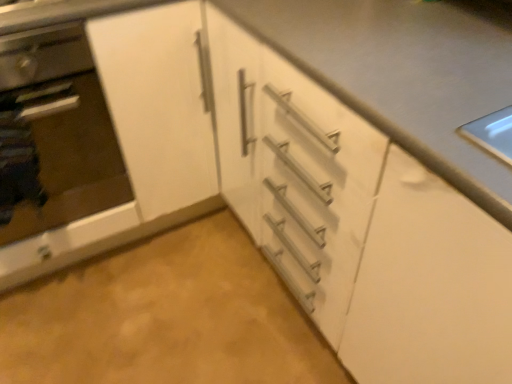
The height and width of the screenshot is (384, 512). I want to click on white matte cabinet at center, so click(x=109, y=133).

You are a GUI agent. You are given a task and a screenshot of the screen. Output one action in this format:
    pyautogui.click(x=<x>, y=<y>)
    Task: Click on the satin silver oven at left
    The width and height of the screenshot is (512, 384).
    Given the screenshot: What is the action you would take?
    pyautogui.click(x=54, y=134)

Where is `white matte countertop at center`? Image resolution: width=512 pixels, height=384 pixels. white matte countertop at center is located at coordinates (406, 73).

Can you tell me how much white matte countertop at center and satin silver oven at left differ in facing direction?

The angle between the facing direction of white matte countertop at center and the facing direction of satin silver oven at left is 89.5 degrees.

Can you confirm if white matte countertop at center is positioned to the left of satin silver oven at left?

Incorrect, white matte countertop at center is not on the left side of satin silver oven at left.

Which of these two, white matte countertop at center or satin silver oven at left, is bigger?

Bigger between the two is white matte countertop at center.

Do you think white matte countertop at center is within satin silver oven at left, or outside of it?

white matte countertop at center exists outside the volume of satin silver oven at left.

Is satin silver oven at left beside white matte cabinet at center?

Yes, satin silver oven at left is in contact with white matte cabinet at center.

Measure the distance from satin silver oven at left to white matte cabinet at center.

3.85 inches.

Is satin silver oven at left positioned before white matte cabinet at center?

Yes.

Looking at this image, does satin silver oven at left have a larger size compared to white matte cabinet at center?

No, satin silver oven at left is not bigger than white matte cabinet at center.

Does white matte cabinet at center have a greater width compared to satin silver oven at left?

Correct, the width of white matte cabinet at center exceeds that of satin silver oven at left.

Is point (136, 192) positioned after point (61, 150)?

No, it is in front of (61, 150).

Considering the sizes of objects white matte cabinet at center and satin silver oven at left in the image provided, who is shorter, white matte cabinet at center or satin silver oven at left?

satin silver oven at left is shorter.

This screenshot has height=384, width=512. I want to click on oven below the white matte cabinet at center (from the image's perspective), so click(54, 134).

Can you confirm if white matte cabinet at center is smaller than white matte countertop at center?

Correct, white matte cabinet at center occupies less space than white matte countertop at center.

Is white matte cabinet at center closer to the viewer compared to white matte countertop at center?

No, white matte cabinet at center is further to the viewer.

In the scene shown: Is white matte cabinet at center not close to white matte countertop at center?

No, white matte cabinet at center is not far from white matte countertop at center.

The height and width of the screenshot is (384, 512). What are the coordinates of `counter top on the right of white matte cabinet at center` in the screenshot? It's located at (406, 73).

In the image, is satin silver oven at left on the left side or the right side of white matte countertop at center?

From the image, it's evident that satin silver oven at left is to the left of white matte countertop at center.

Measure the distance from satin silver oven at left to white matte countertop at center.

They are 27.06 inches apart.

Is satin silver oven at left positioned with its back to white matte countertop at center?

No, satin silver oven at left's orientation is not away from white matte countertop at center.

Considering the relative positions of satin silver oven at left and white matte countertop at center in the image provided, is satin silver oven at left in front of white matte countertop at center?

That is False.

Can you confirm if white matte countertop at center is wider than white matte cabinet at center?

Indeed, white matte countertop at center has a greater width compared to white matte cabinet at center.

From the image's perspective, would you say white matte countertop at center is positioned over white matte cabinet at center?

No, from the image's perspective, white matte countertop at center is not above white matte cabinet at center.

Which point is more distant from viewer, (265, 18) or (143, 141)?

Point (143, 141)

Locate an element on the screen. oven above the white matte countertop at center (from a real-world perspective) is located at coordinates (54, 134).

You are a GUI agent. You are given a task and a screenshot of the screen. Output one action in this format:
    pyautogui.click(x=<x>, y=<y>)
    Task: Click on the cabinetry lying behind the satin silver oven at left
    The width and height of the screenshot is (512, 384).
    Given the screenshot: What is the action you would take?
    pyautogui.click(x=109, y=133)

Estimate the real-world distances between objects in this image. Which object is further from white matte countertop at center, satin silver oven at left or white matte cabinet at center?

satin silver oven at left is further to white matte countertop at center.

When comparing their distances from white matte cabinet at center, does satin silver oven at left or white matte countertop at center seem further?

white matte countertop at center is positioned further to the anchor white matte cabinet at center.

Which object lies further to the anchor point white matte cabinet at center, white matte countertop at center or satin silver oven at left?

The object further to white matte cabinet at center is white matte countertop at center.

Estimate the real-world distances between objects in this image. Which object is further from white matte countertop at center, white matte cabinet at center or satin silver oven at left?

satin silver oven at left lies further to white matte countertop at center than the other object.

From the image, which object appears to be nearer to satin silver oven at left, white matte cabinet at center or white matte countertop at center?

white matte cabinet at center.

Estimate the real-world distances between objects in this image. Which object is further from satin silver oven at left, white matte countertop at center or white matte cabinet at center?

The object further to satin silver oven at left is white matte countertop at center.

The image size is (512, 384). I want to click on cabinetry situated between satin silver oven at left and white matte countertop at center from left to right, so click(109, 133).